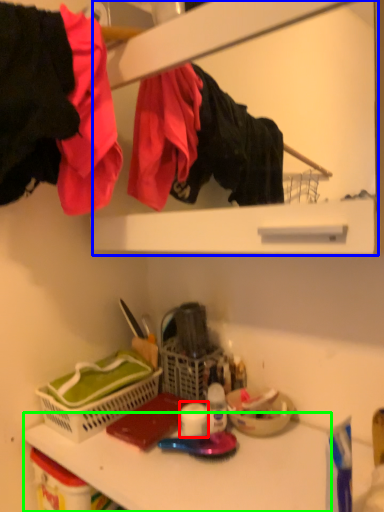
Question: Which object is positioned closest to toilet paper (highlighted by a red box)? Select from medicine cabinet (highlighted by a blue box) and counter top (highlighted by a green box).

Choices:
 (A) medicine cabinet
 (B) counter top

Answer: (B)